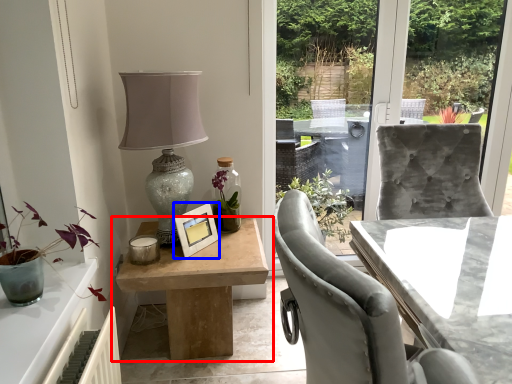
Question: Which point is further to the camera, table (highlighted by a red box) or picture frame (highlighted by a blue box)?

Choices:
 (A) table
 (B) picture frame

Answer: (B)